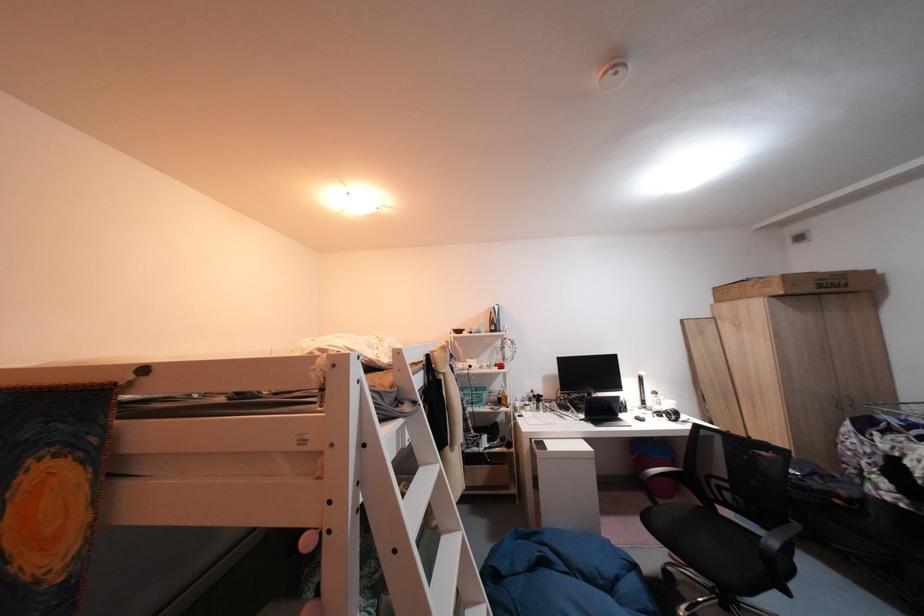
This screenshot has height=616, width=924. Find the location of `black headphones`. black headphones is located at coordinates (667, 413).